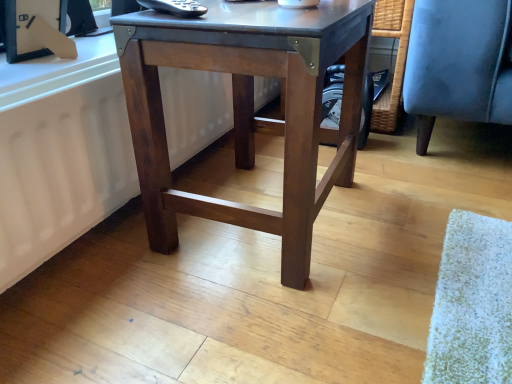
The height and width of the screenshot is (384, 512). I want to click on free spot to the right of dark brown wood table at center, so click(x=414, y=210).